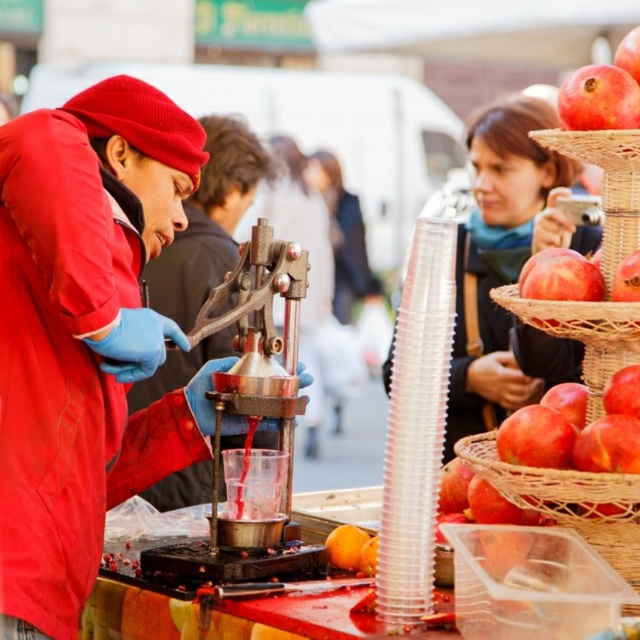
You are a customer standing at the market stall and want to grab your phone to pay. Your phone is the matte black phone at upper right and you are wearing the matte red jacket at left. Can you reach your phone without moving from your current position?

The matte red jacket at left and matte black phone at upper right are 6.52 meters apart from each other, so you cannot reach your phone without moving from your current position.